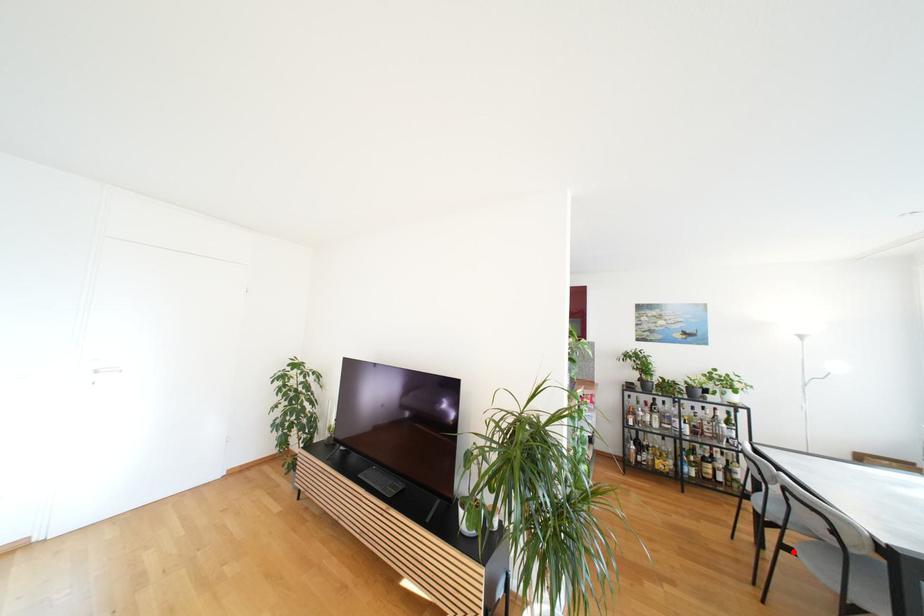
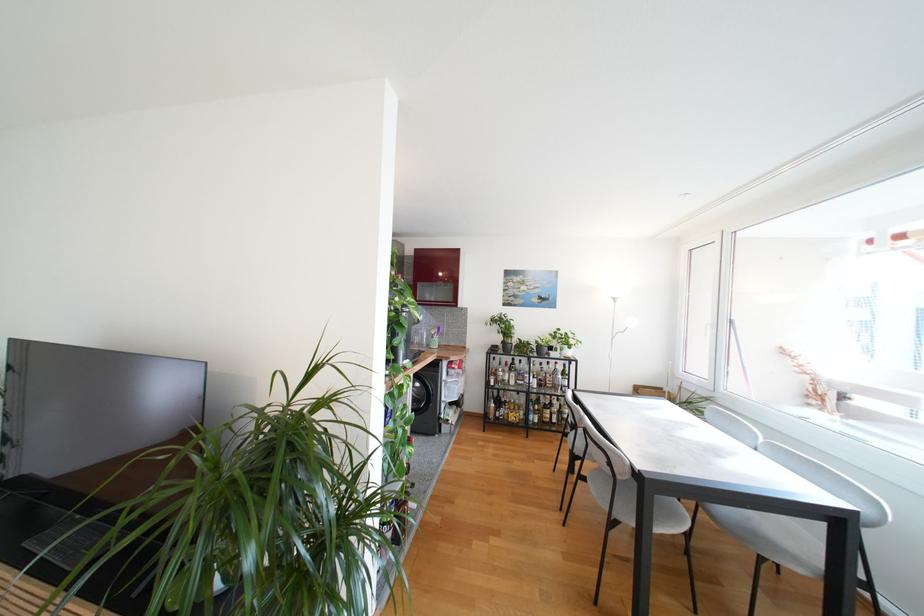
Question: I am providing you with two images of the same scene from different viewpoints. Given a red point in image1, look at the same physical point in image2. Is it:

Choices:
 (A) Closer to the viewpoint
 (B) Farther from the viewpoint

Answer: (A)